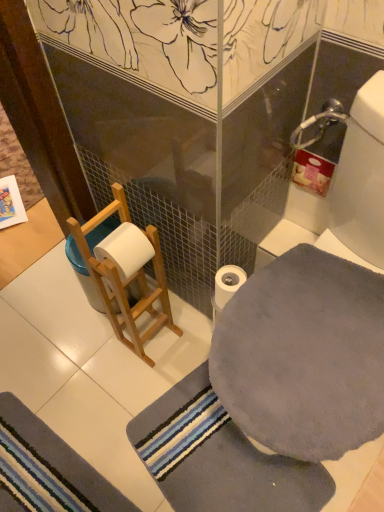
Find the location of a particular element. free spot above gray soft bath towel at lower right, arranged as the first bath towel when ordered from the bottom (from a real-world perspective) is located at coordinates (223, 461).